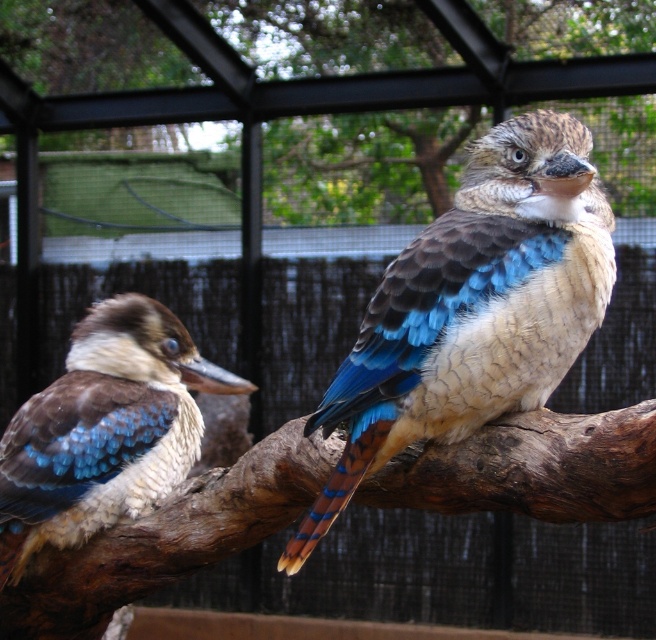
Question: Estimate the real-world distances between objects in this image. Which object is farther from the matte brown and blue bird at center?

Choices:
 (A) brown rough wood at center
 (B) brown wood branch at upper center

Answer: (B)

Question: Observing the image, what is the correct spatial positioning of blue feathered bird at center in reference to brown rough wood at center?

Choices:
 (A) right
 (B) left

Answer: (A)

Question: Which point is farther to the camera?

Choices:
 (A) (356, 394)
 (B) (115, 326)

Answer: (B)

Question: Considering the real-world distances, which object is closest to the matte brown and blue bird at center?

Choices:
 (A) blue feathered bird at center
 (B) brown rough wood at center

Answer: (B)

Question: Does brown wood branch at upper center appear on the left side of blue feathered bird at center?

Choices:
 (A) yes
 (B) no

Answer: (A)

Question: From the image, what is the correct spatial relationship of brown rough wood at center in relation to matte brown and blue bird at center?

Choices:
 (A) below
 (B) above

Answer: (A)